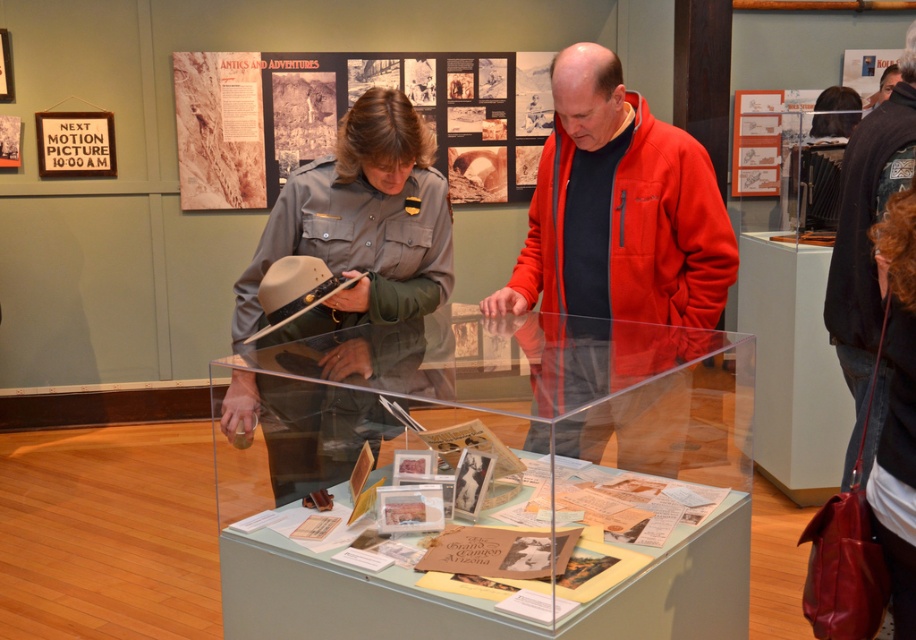
Consider the image. Can you confirm if gray uniform at center is smaller than black woolen jacket at upper right?

No.

Is gray uniform at center positioned at the back of black woolen jacket at upper right?

No, gray uniform at center is in front of black woolen jacket at upper right.

In order to click on gray uniform at center in this screenshot , I will do pyautogui.click(x=360, y=225).

Is red fleece jacket at center to the right of black woolen jacket at upper right from the viewer's perspective?

Incorrect, red fleece jacket at center is not on the right side of black woolen jacket at upper right.

Measure the distance between point (682,292) and camera.

Point (682,292) and camera are 7.76 feet apart from each other.

Does point (554, 124) come closer to viewer compared to point (871, 122)?

That is True.

Where is `red fleece jacket at center`? This screenshot has height=640, width=916. red fleece jacket at center is located at coordinates (667, 230).

Can you confirm if clear acrylic display case at center is positioned to the right of black woolen jacket at upper right?

In fact, clear acrylic display case at center is to the left of black woolen jacket at upper right.

Can you confirm if clear acrylic display case at center is smaller than black woolen jacket at upper right?

No.

Is point (297, 388) positioned behind point (845, 186)?

That is False.

You are a GUI agent. You are given a task and a screenshot of the screen. Output one action in this format:
    pyautogui.click(x=<x>, y=<y>)
    Task: Click on the clear acrylic display case at center
    
    Given the screenshot: What is the action you would take?
    pyautogui.click(x=489, y=477)